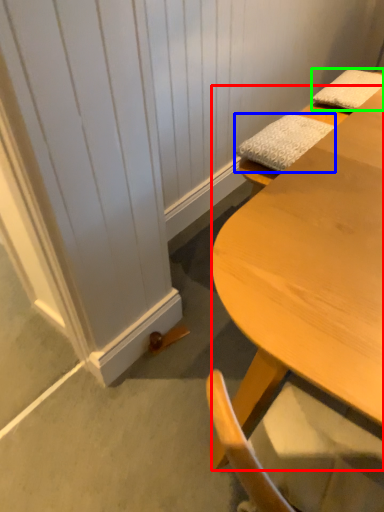
Question: Estimate the real-world distances between objects in this image. Which object is farther from desk (highlighted by a red box), pillow (highlighted by a blue box) or pillow (highlighted by a green box)?

Choices:
 (A) pillow
 (B) pillow

Answer: (B)